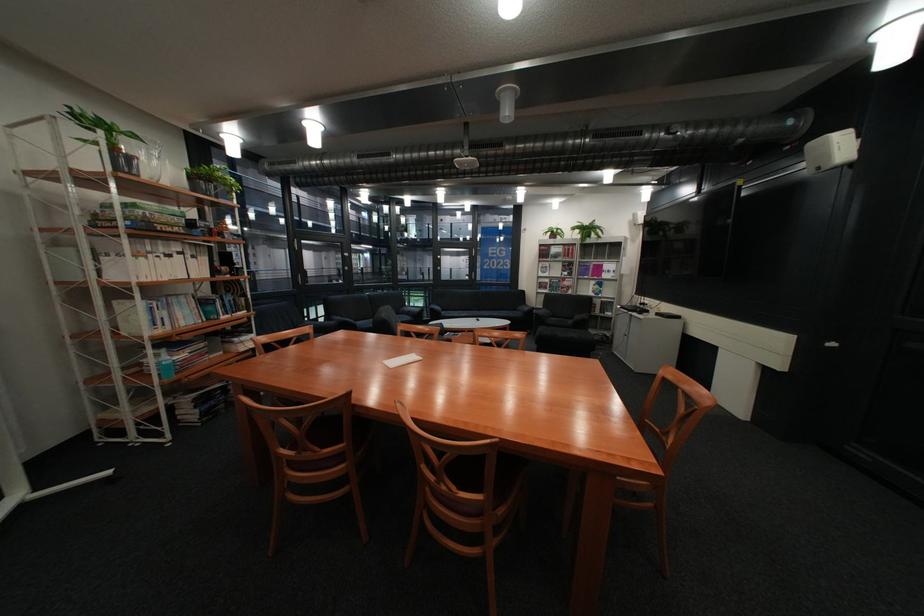
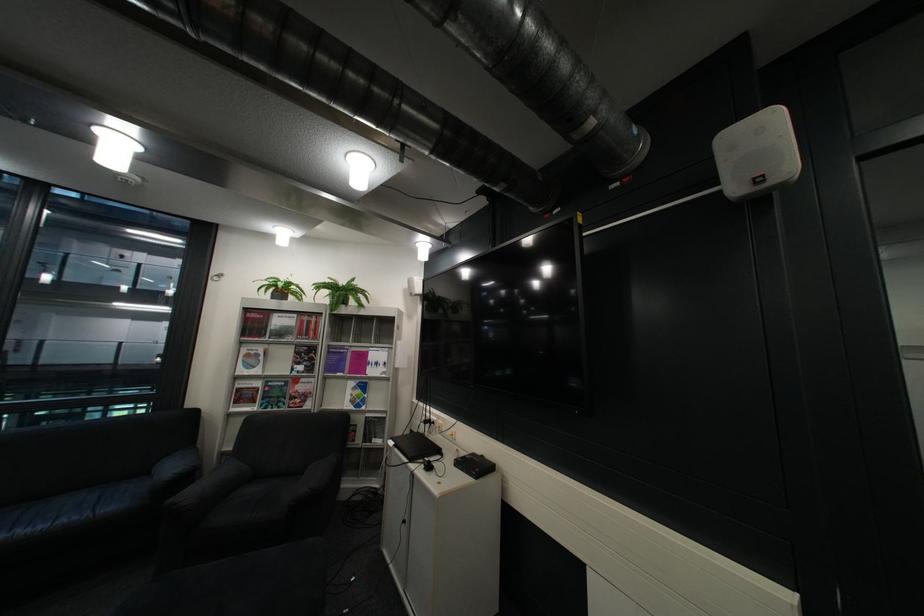
Locate, in the second image, the point that corresponds to (555,249) in the first image.

(260, 320)